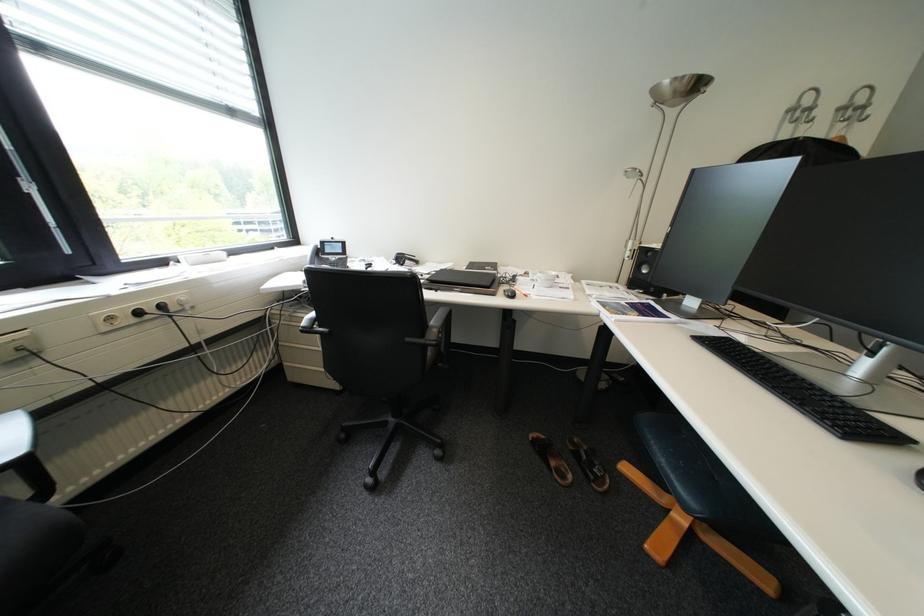
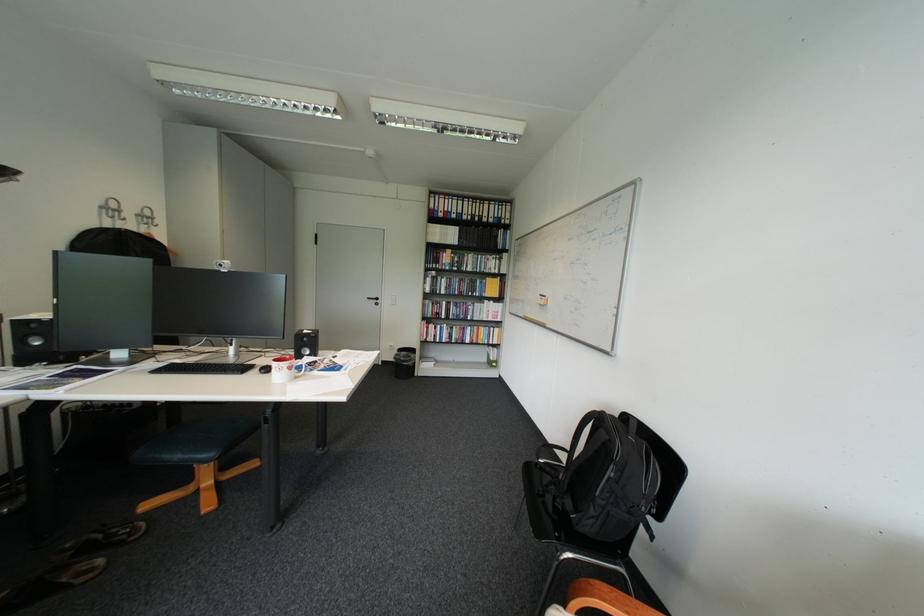
Question: The first image is from the beginning of the video and the second image is from the end. How did the camera likely rotate when shooting the video?

Choices:
 (A) Left
 (B) Right
 (C) Up
 (D) Down

Answer: (B)